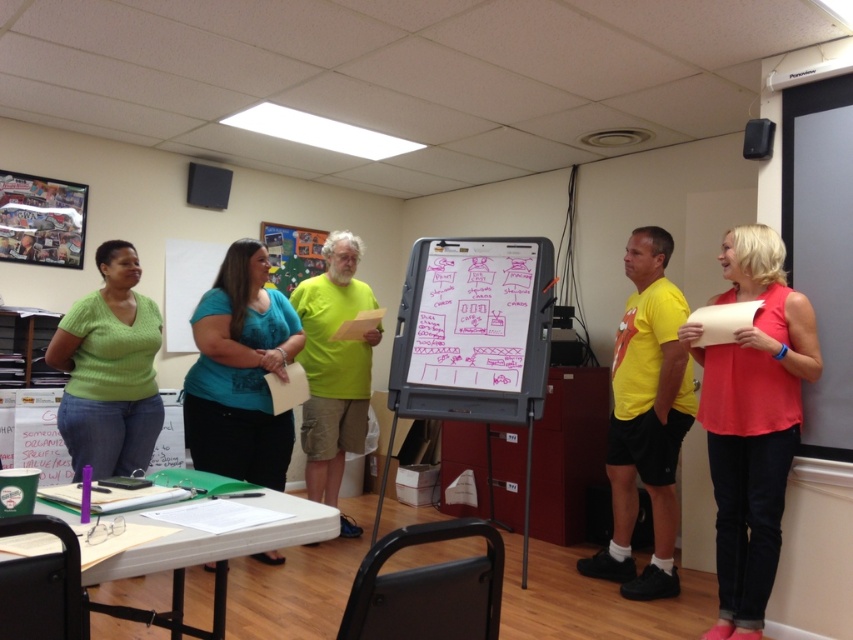
Based on the photo, you are a photographer in the room and want to take a photo of the whiteboard at center and the matte coral blouse at right. Based on their heights, which one should you adjust your camera angle to focus on first?

The matte coral blouse at right is much taller than the whiteboard at center, so you should adjust your camera angle to focus on the matte coral blouse at right first.

You are standing at the entrance of the room and see the whiteboard at center and the green knitted sweater at center. Which object is closer to you?

The green knitted sweater at center is closer to you because the whiteboard at center is further away.

Based on the scene description, where is the teal fabric blouse at center located in terms of its 2D coordinates?

The teal fabric blouse at center is located at the 2D coordinates point [241,372].